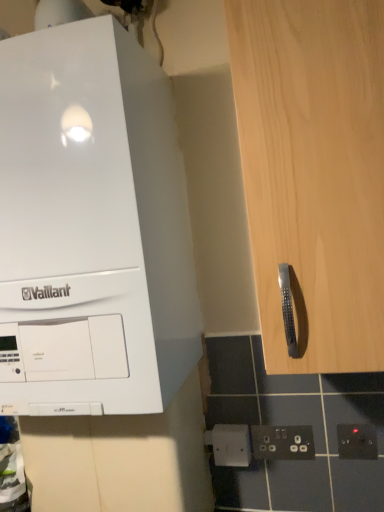
Question: Can you confirm if light wood cabinet handle at right is taller than white plastic socket at lower center, which is the second electric outlet in left-to-right order?

Choices:
 (A) yes
 (B) no

Answer: (A)

Question: Is white plastic socket at lower center, marked as the second electric outlet in a right-to-left arrangement, located within light wood cabinet handle at right?

Choices:
 (A) yes
 (B) no

Answer: (B)

Question: From the image's perspective, does light wood cabinet handle at right appear higher than white plastic socket at lower center, marked as the second electric outlet in a right-to-left arrangement?

Choices:
 (A) no
 (B) yes

Answer: (B)

Question: Does light wood cabinet handle at right have a lesser width compared to white plastic socket at lower center, marked as the second electric outlet in a right-to-left arrangement?

Choices:
 (A) yes
 (B) no

Answer: (B)

Question: Considering the relative sizes of light wood cabinet handle at right and white plastic socket at lower center, which is the second electric outlet in left-to-right order, in the image provided, is light wood cabinet handle at right wider than white plastic socket at lower center, which is the second electric outlet in left-to-right order,?

Choices:
 (A) no
 (B) yes

Answer: (B)

Question: Would you say white glossy vaillant boiler at upper left is inside or outside white plastic electric outlet at lower center, which ranks as the 1th electric outlet in left-to-right order?

Choices:
 (A) inside
 (B) outside

Answer: (B)

Question: Considering the relative positions of white glossy vaillant boiler at upper left and white plastic electric outlet at lower center, positioned as the third electric outlet in right-to-left order, in the image provided, is white glossy vaillant boiler at upper left to the left or to the right of white plastic electric outlet at lower center, positioned as the third electric outlet in right-to-left order,?

Choices:
 (A) left
 (B) right

Answer: (A)

Question: In terms of width, does white glossy vaillant boiler at upper left look wider or thinner when compared to white plastic electric outlet at lower center, which ranks as the 1th electric outlet in left-to-right order?

Choices:
 (A) wide
 (B) thin

Answer: (A)

Question: Is point (122, 309) closer or farther from the camera than point (213, 457)?

Choices:
 (A) farther
 (B) closer

Answer: (B)

Question: Is white glossy vaillant boiler at upper left taller or shorter than black plastic electric outlet at lower right, which ranks as the third electric outlet in left-to-right order?

Choices:
 (A) tall
 (B) short

Answer: (A)

Question: Is white glossy vaillant boiler at upper left wider or thinner than black plastic electric outlet at lower right, which ranks as the third electric outlet in left-to-right order?

Choices:
 (A) thin
 (B) wide

Answer: (B)

Question: Is point [x=110, y=251] closer or farther from the camera than point [x=349, y=438]?

Choices:
 (A) farther
 (B) closer

Answer: (B)

Question: In terms of size, does white glossy vaillant boiler at upper left appear bigger or smaller than black plastic electric outlet at lower right, which ranks as the third electric outlet in left-to-right order?

Choices:
 (A) small
 (B) big

Answer: (B)

Question: Considering the relative positions of white plastic electric outlet at lower center, which ranks as the 1th electric outlet in left-to-right order, and white glossy vaillant boiler at upper left in the image provided, is white plastic electric outlet at lower center, which ranks as the 1th electric outlet in left-to-right order, to the left or to the right of white glossy vaillant boiler at upper left?

Choices:
 (A) right
 (B) left

Answer: (A)

Question: Considering the positions of point (211, 442) and point (114, 77), is point (211, 442) closer or farther from the camera than point (114, 77)?

Choices:
 (A) closer
 (B) farther

Answer: (B)